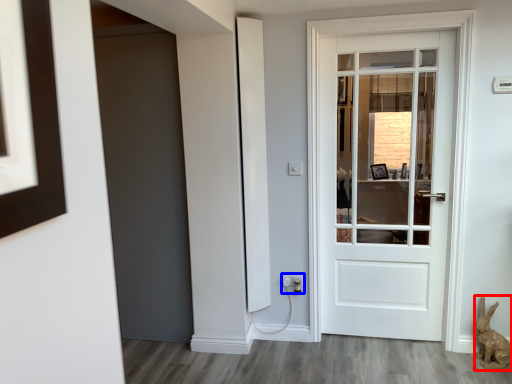
Question: Among these objects, which one is farthest to the camera, animal (highlighted by a red box) or electric outlet (highlighted by a blue box)?

Choices:
 (A) animal
 (B) electric outlet

Answer: (B)